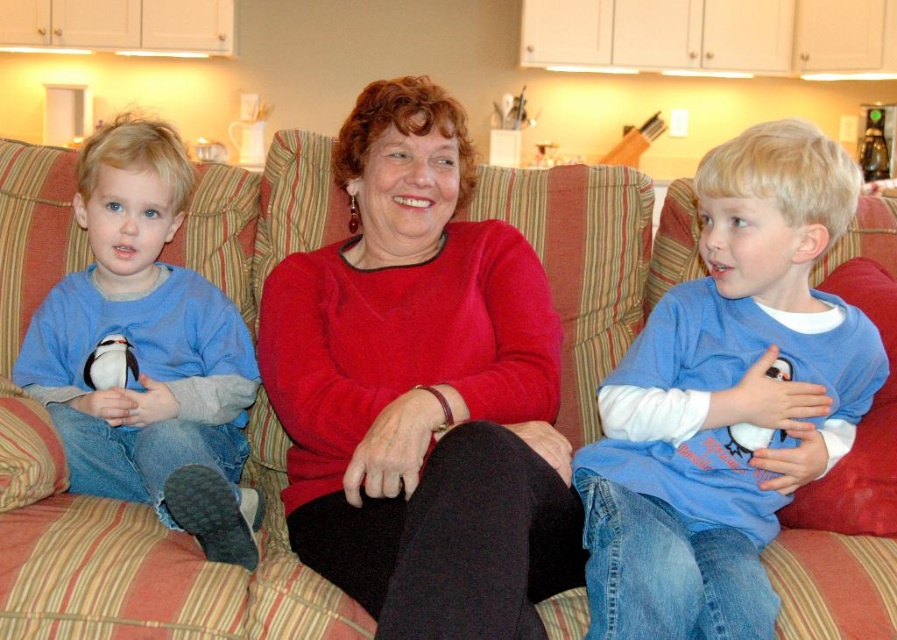
You are designing a new seating arrangement for a living room and want to place a sofa that can accommodate both the matte red sweater at center and the blue cotton shirt at right. Given their sizes, which object requires a wider space on the sofa?

The blue cotton shirt at right requires a wider space on the sofa because its width is greater than the matte red sweater at center.

You are designing a new seating arrangement for a living room and want to place two decorative pillows. The first pillow should match the color of the matte red sweater at center, and the second pillow must match the color of the matte blue shirt at left. If you want the red pillow to be bigger than the blue one, does the current setup support this requirement based on the image?

Yes, the current setup supports this requirement because the matte red sweater at center has a larger size compared to the matte blue shirt at left.

In the scene described, there are two clothing items on the couch. The matte red sweater at center and the blue cotton shirt at right. Which clothing item is positioned to the left of the other?

→ The matte red sweater at center is to the left of the blue cotton shirt at right according to the description.